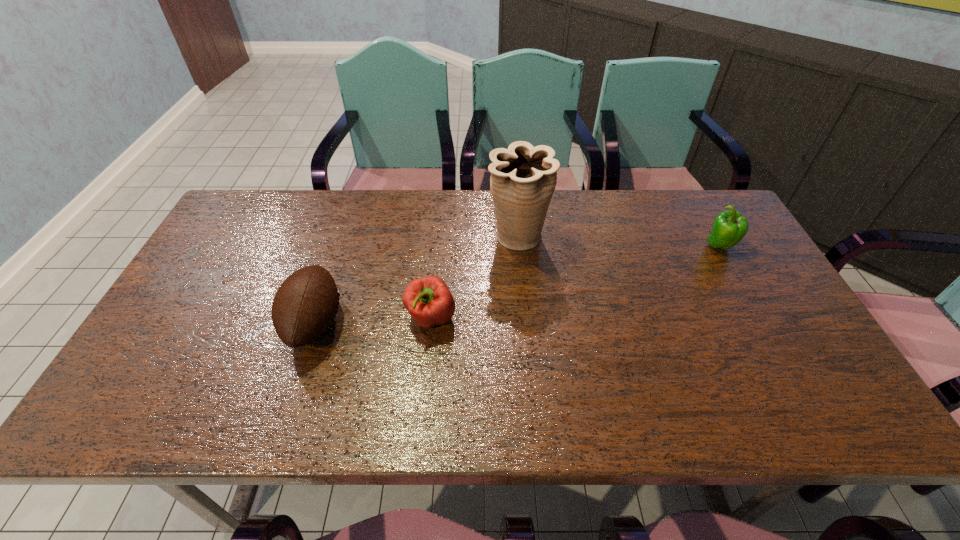
Locate an element on the screen. The width and height of the screenshot is (960, 540). vacant space that is in between the leftmost object and the nearer bell pepper is located at coordinates (372, 321).

The image size is (960, 540). I want to click on empty space between the urn and the rightmost object, so click(618, 241).

At what (x,y) coordinates should I click in order to perform the action: click on vacant area that lies between the rightmost object and the urn. Please return your answer as a coordinate pair (x, y). The image size is (960, 540). Looking at the image, I should click on (618, 241).

The image size is (960, 540). I want to click on free space between the taller bell pepper and the urn, so [618, 241].

Image resolution: width=960 pixels, height=540 pixels. What are the coordinates of `free spot between the shorter bell pepper and the rightmost object` in the screenshot? It's located at (575, 282).

Where is `free space between the leftmost object and the right bell pepper`? Image resolution: width=960 pixels, height=540 pixels. free space between the leftmost object and the right bell pepper is located at coordinates (516, 284).

Find the location of a particular element. free space between the urn and the nearer bell pepper is located at coordinates (474, 278).

Find the location of a particular element. free space between the taller bell pepper and the football is located at coordinates (516, 284).

Identify which object is located as the third nearest to the rightmost object. Please provide its 2D coordinates. Your answer should be formatted as a tuple, i.e. [(x, y)], where the tuple contains the x and y coordinates of a point satisfying the conditions above.

[(305, 305)]

At what (x,y) coordinates should I click in order to perform the action: click on object that is the second closest to the football. Please return your answer as a coordinate pair (x, y). The image size is (960, 540). Looking at the image, I should click on (523, 178).